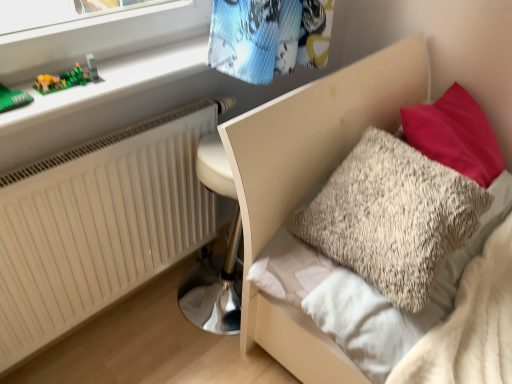
Where is `vacant space situated above white matte radiator at lower left (from a real-world perspective)`? vacant space situated above white matte radiator at lower left (from a real-world perspective) is located at coordinates click(x=104, y=145).